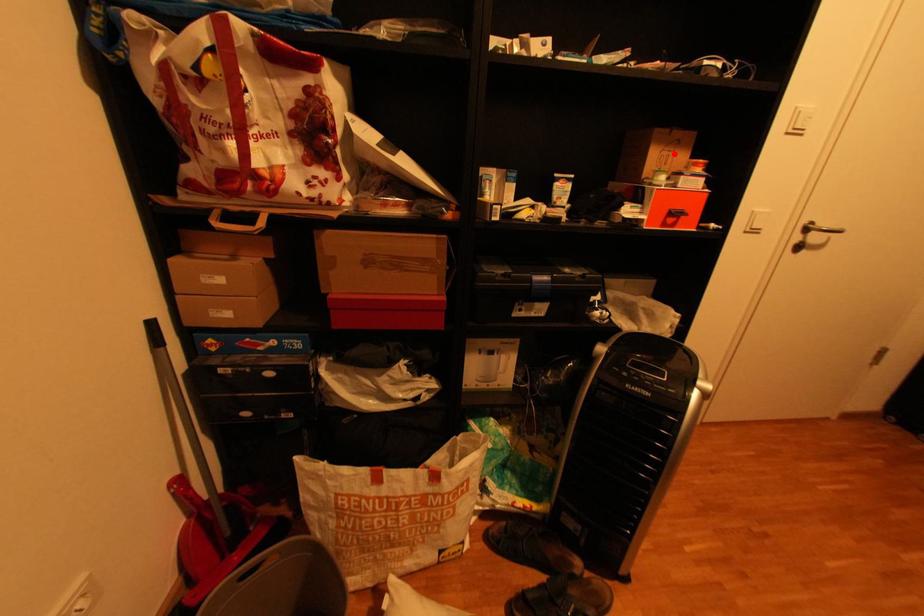
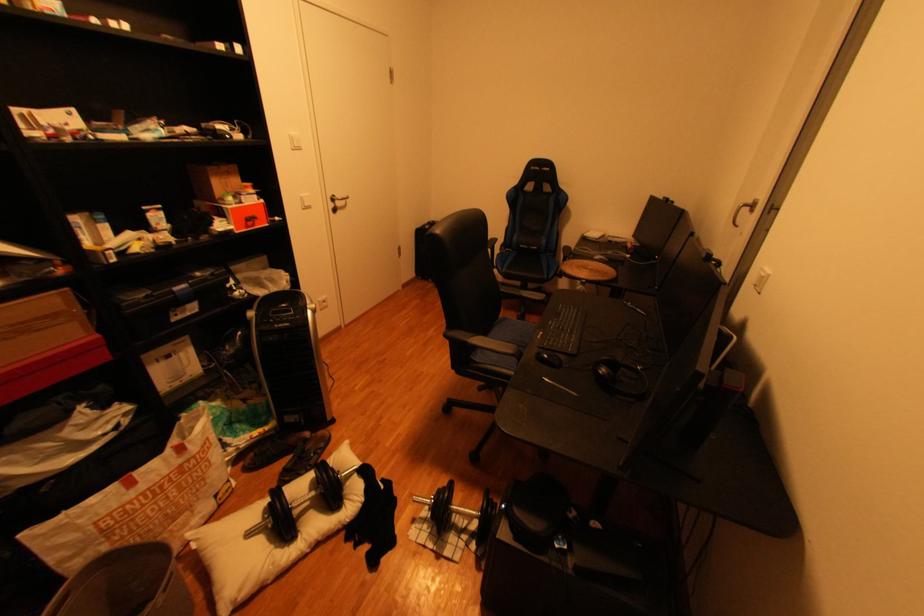
Where in the second image is the point corresponding to the highlighted location from the first image?

(235, 182)